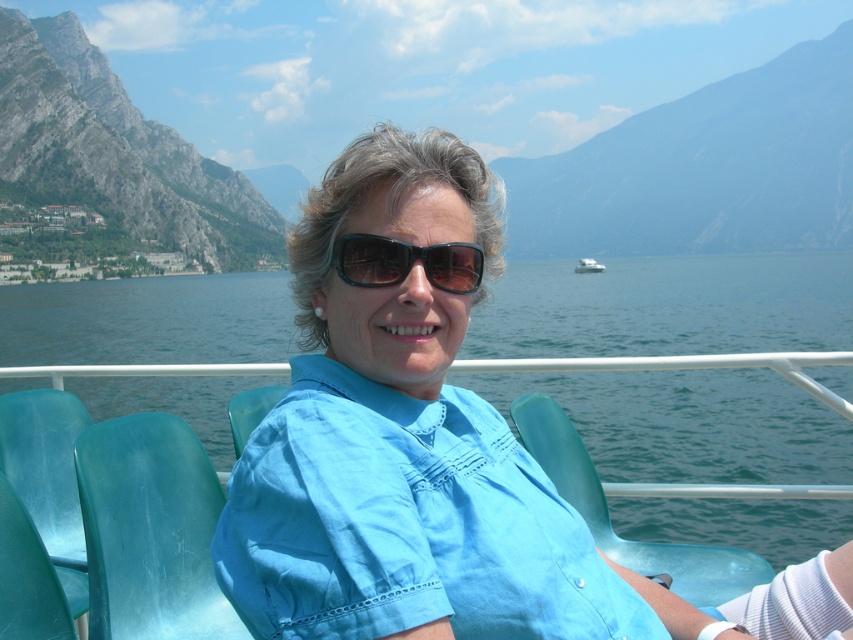
The width and height of the screenshot is (853, 640). Describe the element at coordinates (526, 102) in the screenshot. I see `rocky cliff at upper left` at that location.

Which is behind, point (366, 20) or point (595, 269)?

Point (366, 20)

Identify the location of rocky cliff at upper left. This screenshot has height=640, width=853. (526, 102).

Is matte gray rock at upper center positioned in front of rugged stone mountain at left?

No, it is behind rugged stone mountain at left.

Locate an element on the screen. matte gray rock at upper center is located at coordinates (703, 168).

Locate an element on the screen. matte gray rock at upper center is located at coordinates (703, 168).

Which is behind, point (100, 588) or point (601, 264)?

The point (601, 264) is more distant.

Is point (212, 572) behind point (581, 266)?

No, it is not.

Locate an element on the screen. translucent teal chair at center is located at coordinates (149, 531).